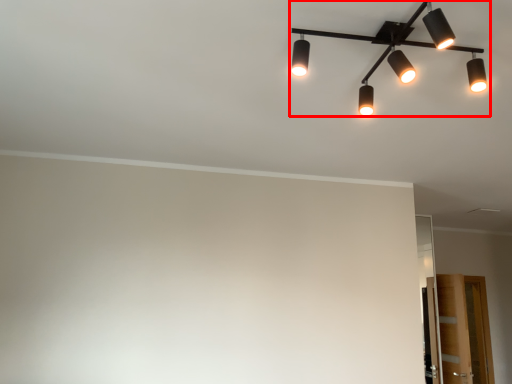
Question: From the image's perspective, what is the correct spatial positioning of lamp (annotated by the red box) in reference to glass door?

Choices:
 (A) above
 (B) below

Answer: (A)